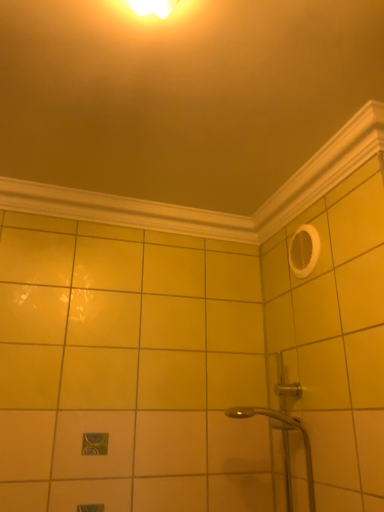
Question: In which direction should I rotate to look at white glossy molding at upper center, the second molding ordered from the bottom?

Choices:
 (A) left
 (B) right

Answer: (A)

Question: In which direction should I rotate to look at white wood molding at upper center, the 2th molding viewed from the top?

Choices:
 (A) right
 (B) left

Answer: (B)

Question: From the image's perspective, is white glossy molding at upper center, the second molding ordered from the bottom, beneath white wood molding at upper center, the 2th molding viewed from the top?

Choices:
 (A) no
 (B) yes

Answer: (A)

Question: From a real-world perspective, is white glossy molding at upper center, the first molding in the top-to-bottom sequence, positioned over white wood molding at upper center, which appears as the 1th molding when ordered from the bottom, based on gravity?

Choices:
 (A) no
 (B) yes

Answer: (B)

Question: Are white glossy molding at upper center, the second molding ordered from the bottom, and white wood molding at upper center, which appears as the 1th molding when ordered from the bottom, located far from each other?

Choices:
 (A) no
 (B) yes

Answer: (A)

Question: Is white glossy molding at upper center, the second molding ordered from the bottom, positioned beyond the bounds of white wood molding at upper center, which appears as the 1th molding when ordered from the bottom?

Choices:
 (A) no
 (B) yes

Answer: (B)

Question: Does white glossy molding at upper center, the first molding in the top-to-bottom sequence, have a lesser width compared to white wood molding at upper center, the 2th molding viewed from the top?

Choices:
 (A) no
 (B) yes

Answer: (A)

Question: Is white glossy molding at upper center, the second molding ordered from the bottom, bigger than white wood molding at upper center, the 2th molding viewed from the top?

Choices:
 (A) no
 (B) yes

Answer: (B)

Question: Does white wood molding at upper center, which appears as the 1th molding when ordered from the bottom, have a larger size compared to white glossy molding at upper center, the first molding in the top-to-bottom sequence?

Choices:
 (A) no
 (B) yes

Answer: (A)

Question: Can you confirm if white wood molding at upper center, which appears as the 1th molding when ordered from the bottom, is positioned to the right of white glossy molding at upper center, the first molding in the top-to-bottom sequence?

Choices:
 (A) yes
 (B) no

Answer: (B)

Question: From a real-world perspective, does white wood molding at upper center, the 2th molding viewed from the top, stand above white glossy molding at upper center, the second molding ordered from the bottom?

Choices:
 (A) yes
 (B) no

Answer: (B)

Question: From the image's perspective, would you say white wood molding at upper center, the 2th molding viewed from the top, is shown under white glossy molding at upper center, the first molding in the top-to-bottom sequence?

Choices:
 (A) yes
 (B) no

Answer: (A)

Question: Considering the relative sizes of white wood molding at upper center, the 2th molding viewed from the top, and white glossy molding at upper center, the second molding ordered from the bottom, in the image provided, is white wood molding at upper center, the 2th molding viewed from the top, thinner than white glossy molding at upper center, the second molding ordered from the bottom,?

Choices:
 (A) yes
 (B) no

Answer: (A)

Question: Does white wood molding at upper center, which appears as the 1th molding when ordered from the bottom, have a smaller size compared to white glossy molding at upper center, the second molding ordered from the bottom?

Choices:
 (A) no
 (B) yes

Answer: (B)

Question: Looking at their shapes, would you say white wood molding at upper center, which appears as the 1th molding when ordered from the bottom, is wider or thinner than white glossy molding at upper center, the first molding in the top-to-bottom sequence?

Choices:
 (A) wide
 (B) thin

Answer: (B)